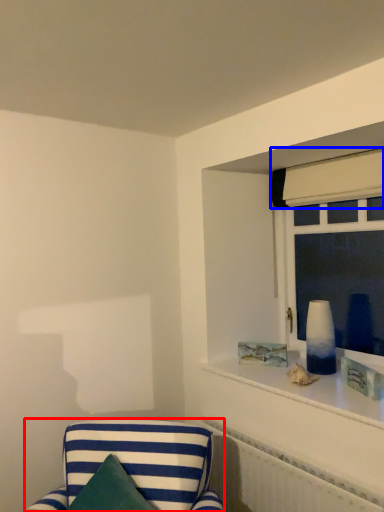
Question: Which object appears closest to the camera in this image, furniture (highlighted by a red box) or curtain (highlighted by a blue box)?

Choices:
 (A) furniture
 (B) curtain

Answer: (A)